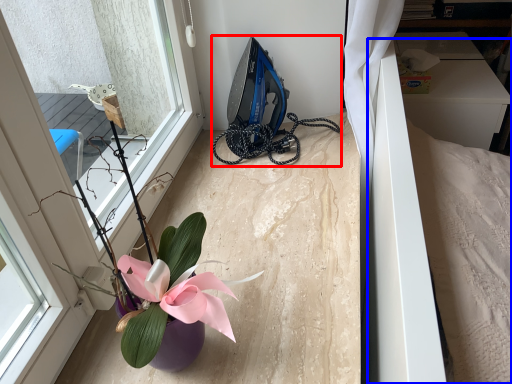
Question: Which object appears closest to the camera in this image, equipment (highlighted by a red box) or bed (highlighted by a blue box)?

Choices:
 (A) equipment
 (B) bed

Answer: (A)